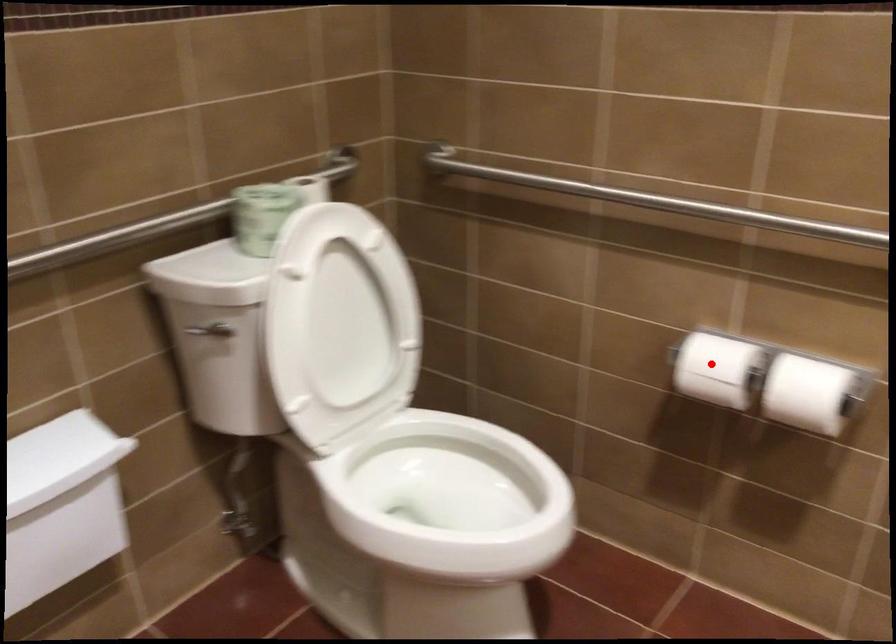
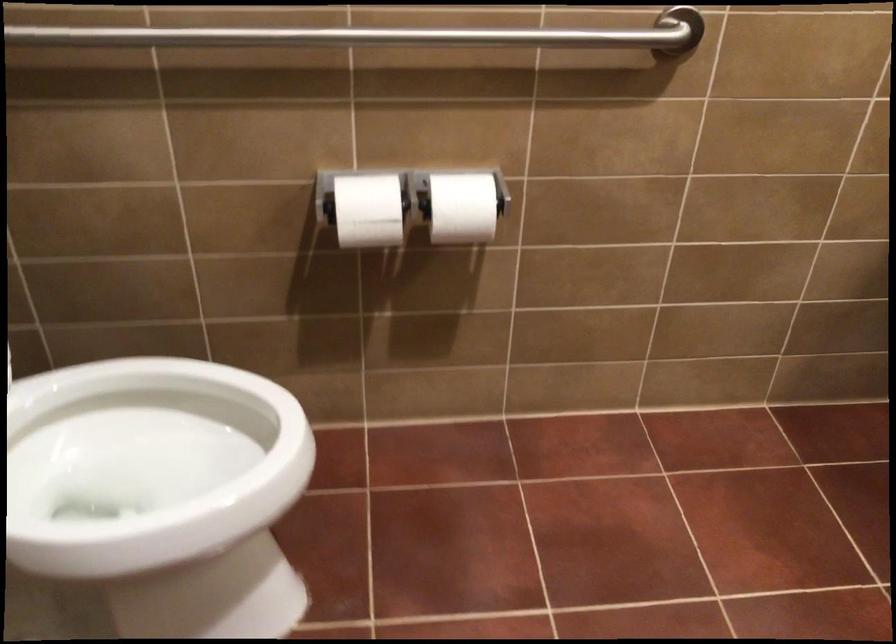
In the second image, find the point that corresponds to the highlighted location in the first image.

(367, 210)